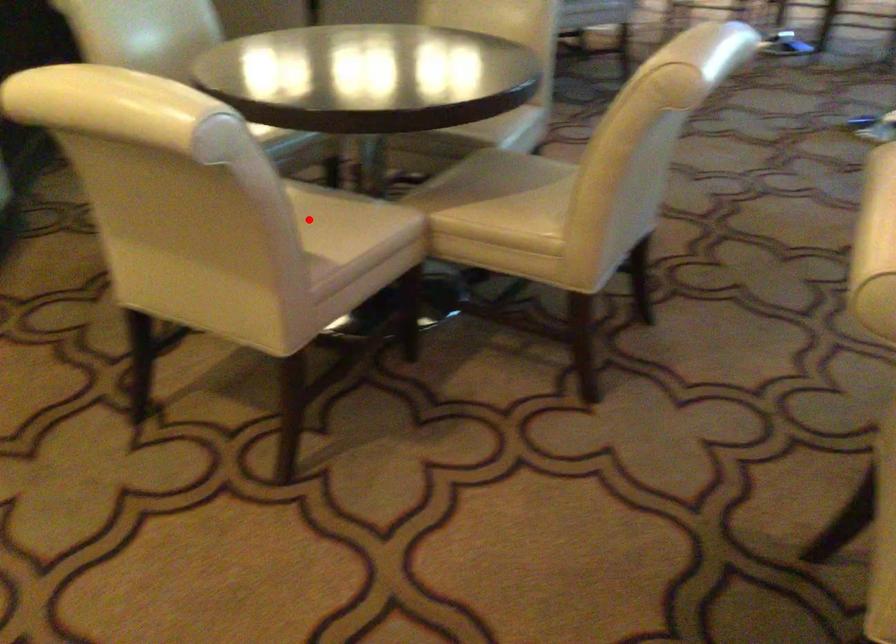
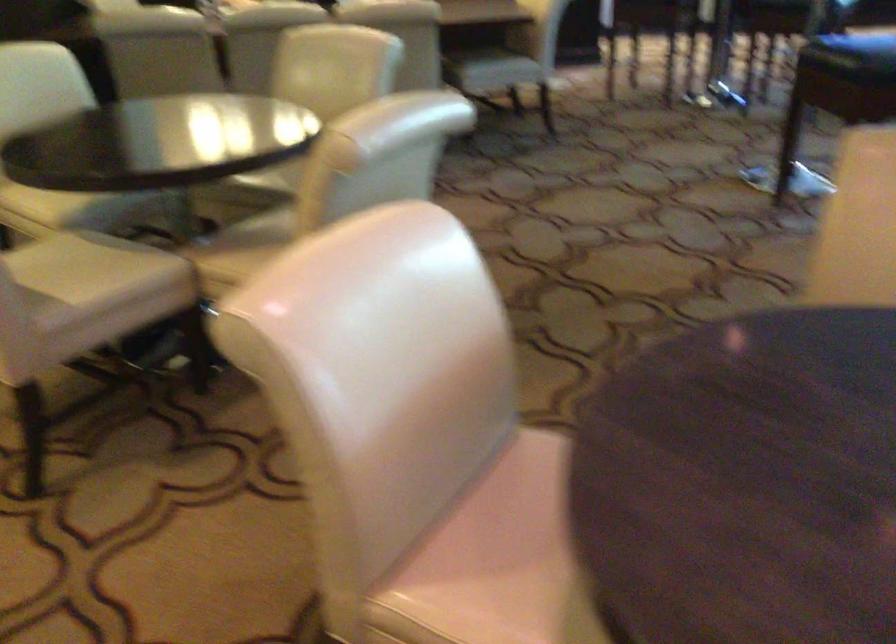
Where in the second image is the point corresponding to the highlighted location from the first image?

(82, 266)